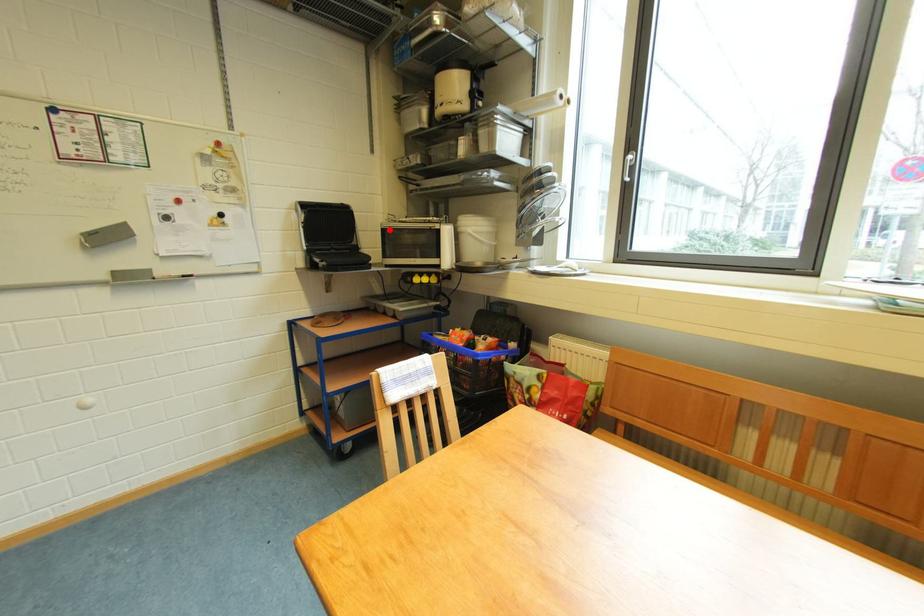
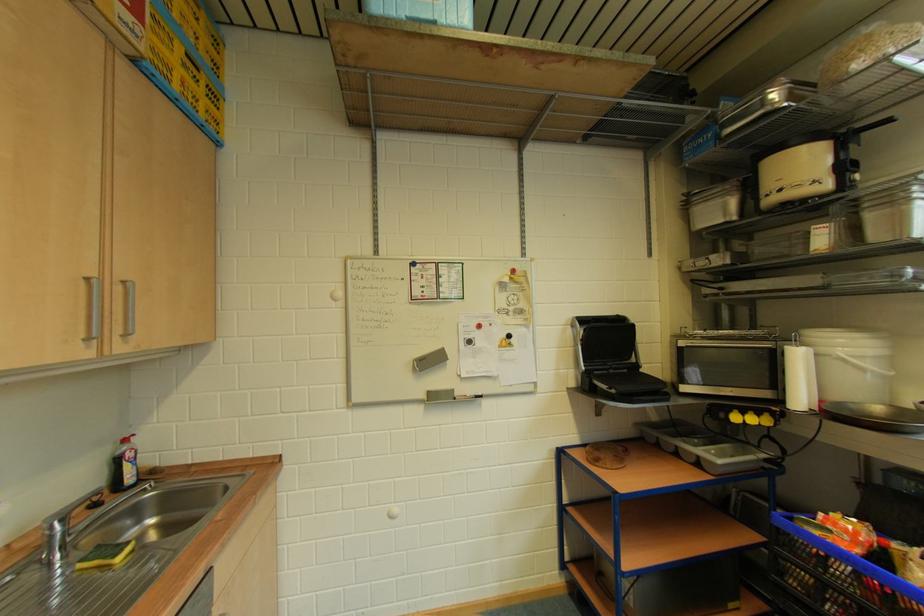
Find the pixel in the second image that matches the highlighted location in the first image.

(687, 347)